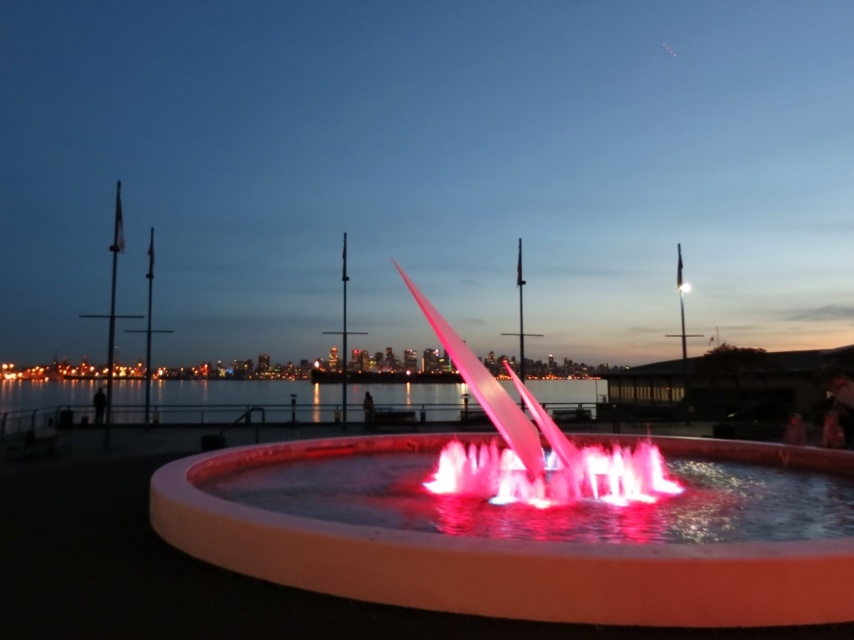
Question: Is matte pink fountain at center bigger than transparent water at center?

Choices:
 (A) no
 (B) yes

Answer: (A)

Question: Is matte pink fountain at center closer to camera compared to transparent water at center?

Choices:
 (A) yes
 (B) no

Answer: (A)

Question: Is matte pink fountain at center closer to the viewer compared to transparent water at center?

Choices:
 (A) yes
 (B) no

Answer: (A)

Question: Which point is farther to the camera?

Choices:
 (A) transparent water at center
 (B) matte pink fountain at center

Answer: (A)

Question: Among these points, which one is nearest to the camera?

Choices:
 (A) (784, 458)
 (B) (1, 412)

Answer: (A)